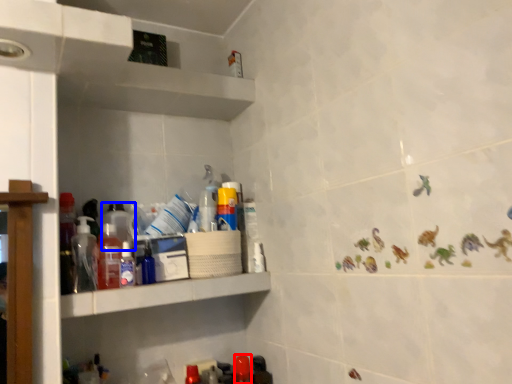
Question: Among these objects, which one is farthest to the camera, bottle (highlighted by a red box) or bottle (highlighted by a blue box)?

Choices:
 (A) bottle
 (B) bottle

Answer: (A)